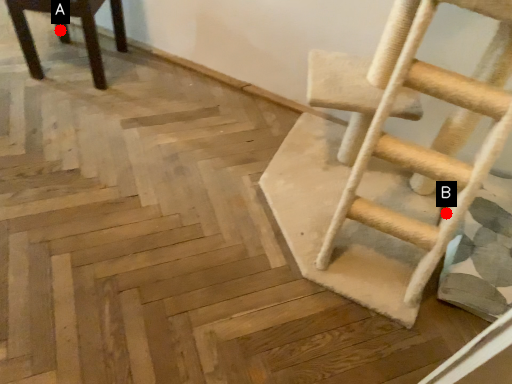
Question: Two points are circled on the image, labeled by A and B beside each circle. Which of the following is the farthest from the observer?

Choices:
 (A) A is further
 (B) B is further

Answer: (A)